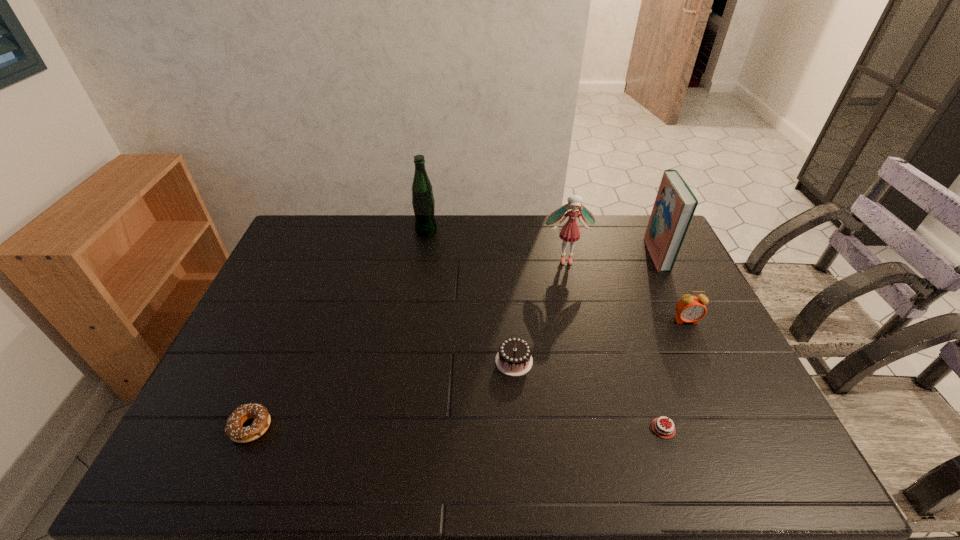
Locate an element on the screen. The image size is (960, 540). vacant space at the far edge of the desktop is located at coordinates (396, 214).

This screenshot has width=960, height=540. In order to click on free space at the near edge of the desktop in this screenshot , I will do `click(646, 477)`.

What are the coordinates of `vacant point at the left edge` in the screenshot? It's located at (315, 260).

The height and width of the screenshot is (540, 960). I want to click on vacant space at the far right corner of the desktop, so click(x=634, y=243).

Locate an element on the screen. free space at the near right corner of the desktop is located at coordinates (762, 449).

The height and width of the screenshot is (540, 960). What are the coordinates of `free point between the fourth object from right to left and the sixth tallest object` in the screenshot? It's located at (409, 343).

Image resolution: width=960 pixels, height=540 pixels. I want to click on vacant space that's between the shorter chocolate cake and the fourth shortest object, so click(x=675, y=374).

Locate an element on the screen. The height and width of the screenshot is (540, 960). vacant area between the hardback book and the fifth object from left to right is located at coordinates (660, 341).

Where is `vacant space that's between the beer bottle and the fourth farthest object`? This screenshot has height=540, width=960. vacant space that's between the beer bottle and the fourth farthest object is located at coordinates [556, 275].

This screenshot has height=540, width=960. I want to click on unoccupied area between the fifth tallest object and the fourth farthest object, so click(x=600, y=341).